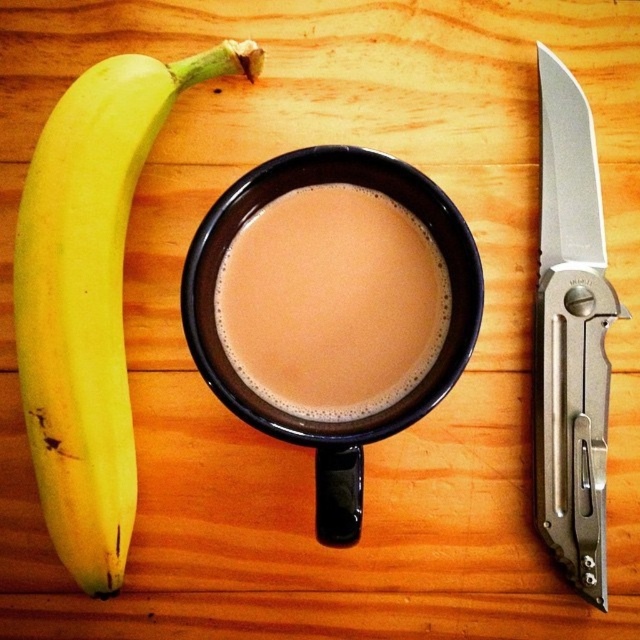
Question: Does yellow matte banana at left have a lesser width compared to silver metallic pocketknife at right?

Choices:
 (A) no
 (B) yes

Answer: (A)

Question: In this image, where is yellow matte banana at left located relative to brown matte mug at center?

Choices:
 (A) right
 (B) left

Answer: (B)

Question: Which of the following is the closest to the observer?

Choices:
 (A) silver metallic pocketknife at right
 (B) yellow matte banana at left

Answer: (B)

Question: Which point is closer to the camera?

Choices:
 (A) (268, 392)
 (B) (554, 100)
 (C) (416, 417)
 (D) (81, 573)

Answer: (C)

Question: Does yellow matte banana at left appear over silver metallic pocketknife at right?

Choices:
 (A) no
 (B) yes

Answer: (B)

Question: Among these points, which one is nearest to the camera?

Choices:
 (A) (36, 436)
 (B) (292, 276)
 (C) (380, 422)
 (D) (588, 264)

Answer: (C)